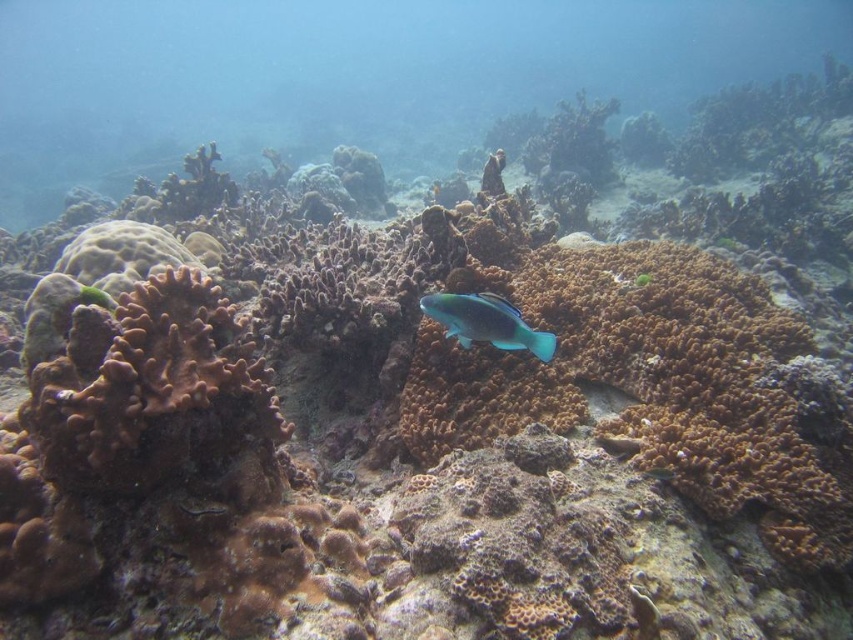
The height and width of the screenshot is (640, 853). What do you see at coordinates (151, 388) in the screenshot?
I see `brown rough coral at left` at bounding box center [151, 388].

Between point (141, 349) and point (508, 321), which one is positioned behind?

The point (508, 321) is behind.

Locate an element on the screen. The image size is (853, 640). brown rough coral at left is located at coordinates (151, 388).

Where is `brown rough coral at left`? This screenshot has height=640, width=853. brown rough coral at left is located at coordinates [x=151, y=388].